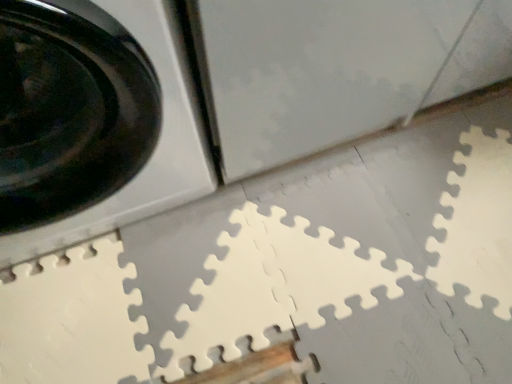
What are the coordinates of `black glossy washing machine at upper left` in the screenshot? It's located at (98, 125).

What do you see at coordinates (98, 125) in the screenshot? I see `black glossy washing machine at upper left` at bounding box center [98, 125].

At what (x,y) coordinates should I click in order to perform the action: click on black glossy washing machine at upper left. Please return your answer as a coordinate pair (x, y). The width and height of the screenshot is (512, 384). Looking at the image, I should click on (98, 125).